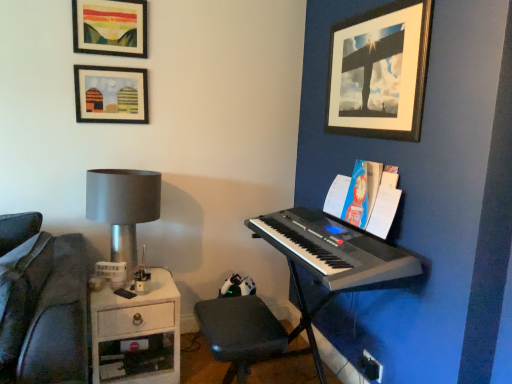
At what (x,y) coordinates should I click in order to perform the action: click on free space above wooden picture frame at upper right, which is the third picture frame in left-to-right order (from a real-world perspective). Please return your answer as a coordinate pair (x, y). The width and height of the screenshot is (512, 384). Looking at the image, I should click on (371, 9).